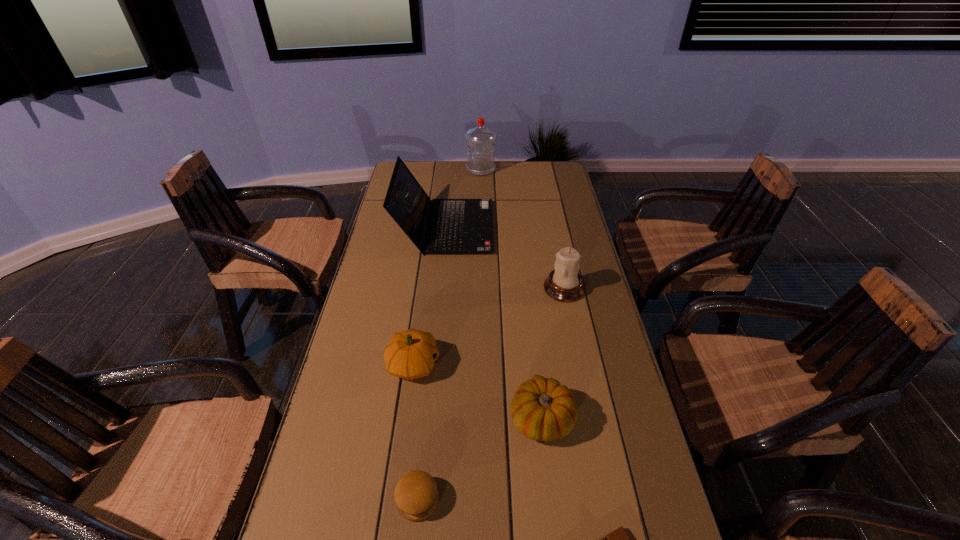
Where is `free space between the farthest object and the laptop computer`? free space between the farthest object and the laptop computer is located at coordinates (463, 198).

Where is `free point between the water bottle and the right gourd`? The height and width of the screenshot is (540, 960). free point between the water bottle and the right gourd is located at coordinates (512, 294).

Identify the location of unoccupied position between the hamburger and the left gourd. (416, 432).

The height and width of the screenshot is (540, 960). What are the coordinates of `free space that is in between the fifth tallest object and the second farthest object` in the screenshot? It's located at (493, 323).

This screenshot has width=960, height=540. Find the location of `empty space that is in between the sixth nearest object and the shorter gourd`. empty space that is in between the sixth nearest object and the shorter gourd is located at coordinates (493, 323).

You are a GUI agent. You are given a task and a screenshot of the screen. Output one action in this format:
    pyautogui.click(x=<x>, y=<y>)
    Task: Click on the free spot between the shorter gourd and the sixth nearest object
    The width and height of the screenshot is (960, 540).
    Given the screenshot: What is the action you would take?
    pyautogui.click(x=493, y=323)

Where is `free space between the right gourd and the laptop computer`? free space between the right gourd and the laptop computer is located at coordinates (493, 323).

Locate an element on the screen. object that is the third nearest to the sixth nearest object is located at coordinates (410, 354).

Select which object is the second closest to the farther gourd. Please provide its 2D coordinates. Your answer should be formatted as a tuple, i.e. [(x, y)], where the tuple contains the x and y coordinates of a point satisfying the conditions above.

[(416, 495)]

Where is `free location that satisfies the following two spatial constraints: 1. on the side of the left gourd with the carved face; 2. on the left side of the second nearest object`? Image resolution: width=960 pixels, height=540 pixels. free location that satisfies the following two spatial constraints: 1. on the side of the left gourd with the carved face; 2. on the left side of the second nearest object is located at coordinates (395, 500).